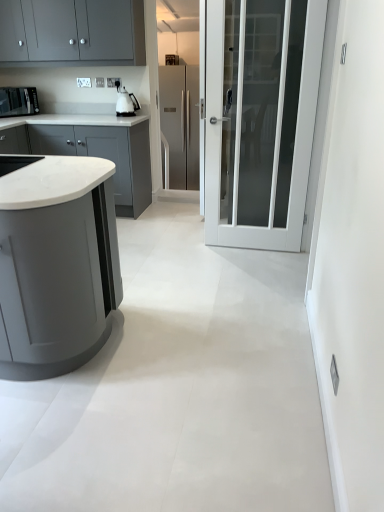
Question: Is matte gray cabinets at upper left, the third cabinetry positioned from the bottom, wider or thinner than matte black microwave at upper left, placed as the second kitchen appliance when sorted from right to left?

Choices:
 (A) wide
 (B) thin

Answer: (A)

Question: Is point (31, 0) positioned closer to the camera than point (31, 106)?

Choices:
 (A) farther
 (B) closer

Answer: (B)

Question: Estimate the real-world distances between objects in this image. Which object is farther from the white marble countertop at left, which is counted as the 3th cabinetry, starting from the front?

Choices:
 (A) matte black microwave at upper left, placed as the 1th kitchen appliance when sorted from left to right
 (B) stainless steel refrigerator at center
 (C) white glass door at center
 (D) matte gray cabinet at left, which appears as the 1th cabinetry when viewed from the front
 (E) matte gray cabinets at upper left, positioned as the second cabinetry in front-to-back order

Answer: (D)

Question: Which is farther from the matte gray cabinet at left, which appears as the 1th cabinetry when viewed from the front?

Choices:
 (A) white marble countertop at left, which is counted as the 3th cabinetry, starting from the front
 (B) white glossy kettle at upper center, which is the 2th kitchen appliance from left to right
 (C) white glass door at center
 (D) stainless steel refrigerator at center
 (E) matte black microwave at upper left, placed as the second kitchen appliance when sorted from right to left

Answer: (D)